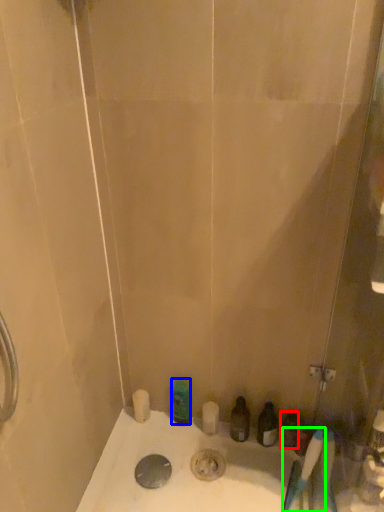
Question: Which object is the farthest from toiletry (highlighted by a red box)? Choose among these: toiletry (highlighted by a blue box) or brush (highlighted by a green box).

Choices:
 (A) toiletry
 (B) brush

Answer: (A)